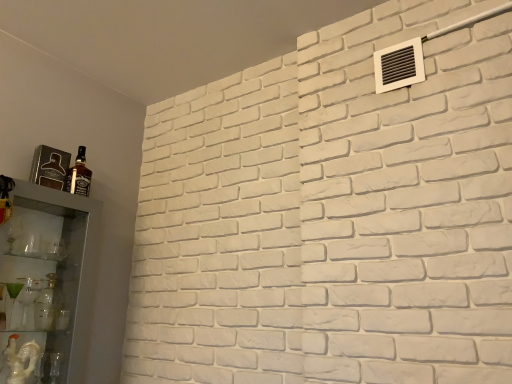
Question: Is white plastic vent at upper right thinner than matte glass bottle at left?

Choices:
 (A) yes
 (B) no

Answer: (A)

Question: Is white plastic vent at upper right next to matte glass bottle at left and touching it?

Choices:
 (A) no
 (B) yes

Answer: (A)

Question: Can you confirm if white plastic vent at upper right is bigger than matte glass bottle at left?

Choices:
 (A) yes
 (B) no

Answer: (A)

Question: From a real-world perspective, is white plastic vent at upper right located beneath matte glass bottle at left?

Choices:
 (A) yes
 (B) no

Answer: (B)

Question: Can you confirm if white plastic vent at upper right is taller than matte glass bottle at left?

Choices:
 (A) yes
 (B) no

Answer: (B)

Question: Is white plastic vent at upper right oriented towards matte glass bottle at left?

Choices:
 (A) yes
 (B) no

Answer: (B)

Question: Considering the relative sizes of matte glass bottle at left and white plastic vent at upper right in the image provided, is matte glass bottle at left bigger than white plastic vent at upper right?

Choices:
 (A) no
 (B) yes

Answer: (A)

Question: Is matte glass bottle at left outside white plastic vent at upper right?

Choices:
 (A) no
 (B) yes

Answer: (B)

Question: Is matte glass bottle at left shorter than white plastic vent at upper right?

Choices:
 (A) yes
 (B) no

Answer: (B)

Question: Is matte glass bottle at left facing away from white plastic vent at upper right?

Choices:
 (A) yes
 (B) no

Answer: (B)

Question: Is matte glass bottle at left with white plastic vent at upper right?

Choices:
 (A) yes
 (B) no

Answer: (B)

Question: From the image's perspective, is matte glass bottle at left below white plastic vent at upper right?

Choices:
 (A) no
 (B) yes

Answer: (B)

Question: From the image's perspective, is matte glass bottle at left located above clear glass cabinet at left?

Choices:
 (A) yes
 (B) no

Answer: (A)